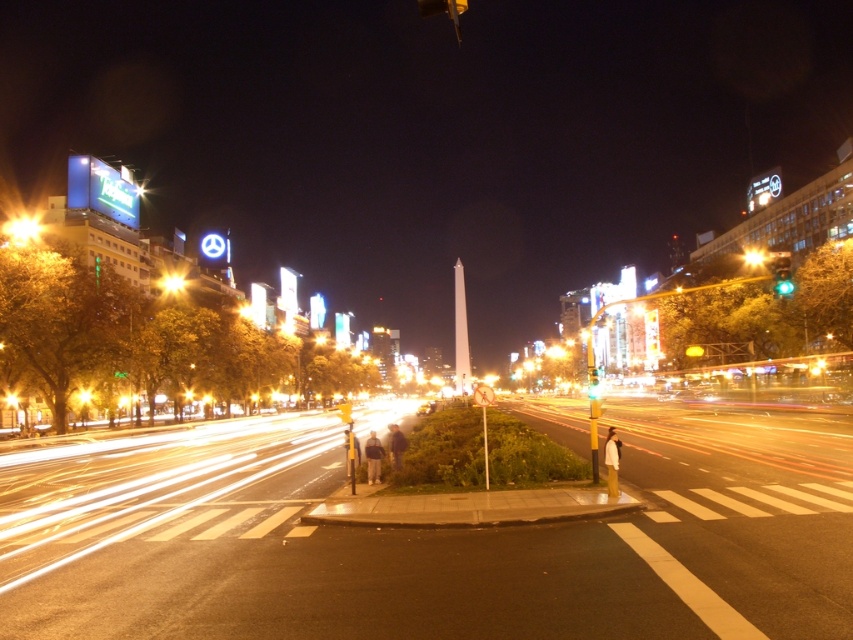
You are standing at the pedestrian crossing at the bottom right corner of the image. You notice two points in the scene labeled as point 1 and point 2. Point 1 is at coordinates (775, 276) and point 2 is at (749, 257). Which point is closer to you?

Point 1 at coordinates (775, 276) is closer to the viewer than point 2 at (749, 257).

You are a photographer planning to capture the white obelisk monument in the center. You want to ensure that both the metallic billboard at upper left and the green glass traffic light at center are visible in your shot. Which object will occupy more horizontal space in the photo?

The metallic billboard at upper left will occupy more horizontal space in the photo because its width surpasses that of the green glass traffic light at center.